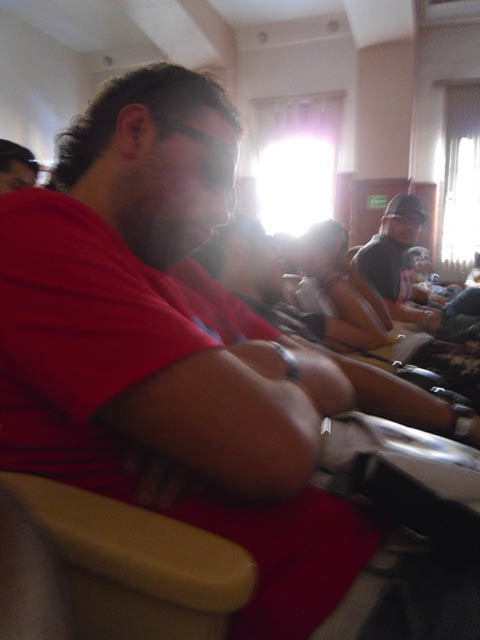
Question: Among these objects, which one is nearest to the camera?

Choices:
 (A) smooth beige armrest at lower left
 (B) dark gray cap at upper right

Answer: (A)

Question: Which object appears farthest from the camera in this image?

Choices:
 (A) smooth beige armrest at lower left
 (B) matte red shirt at center
 (C) dark gray cap at upper right

Answer: (C)

Question: Can you confirm if dark gray cap at upper right is wider than matte red shirt at center?

Choices:
 (A) no
 (B) yes

Answer: (B)

Question: Which object is the farthest from the matte red shirt at center?

Choices:
 (A) smooth beige armrest at lower left
 (B) dark gray cap at upper right

Answer: (B)

Question: Can you confirm if dark gray cap at upper right is bigger than matte red shirt at center?

Choices:
 (A) yes
 (B) no

Answer: (A)

Question: Does smooth beige armrest at lower left appear on the left side of dark gray cap at upper right?

Choices:
 (A) yes
 (B) no

Answer: (A)